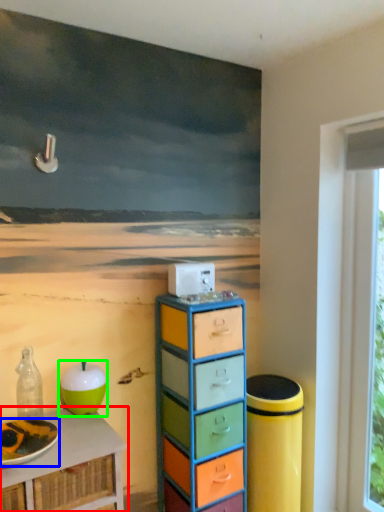
Question: Which is farther away from table (highlighted by a red box)? plate (highlighted by a blue box) or apple (highlighted by a green box)?

Choices:
 (A) plate
 (B) apple

Answer: (B)